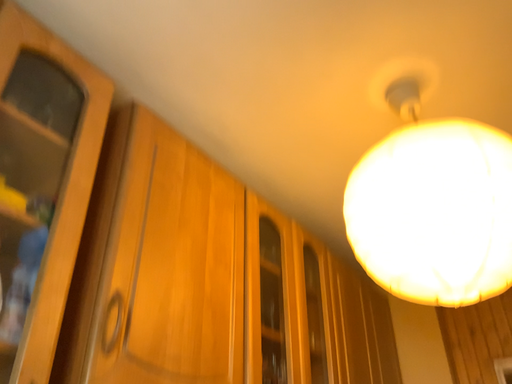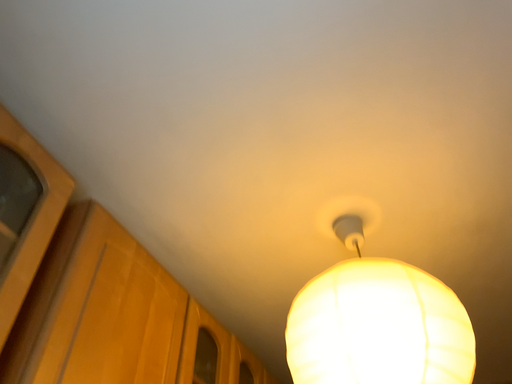
Question: How did the camera likely rotate when shooting the video?

Choices:
 (A) rotated left
 (B) rotated right

Answer: (B)